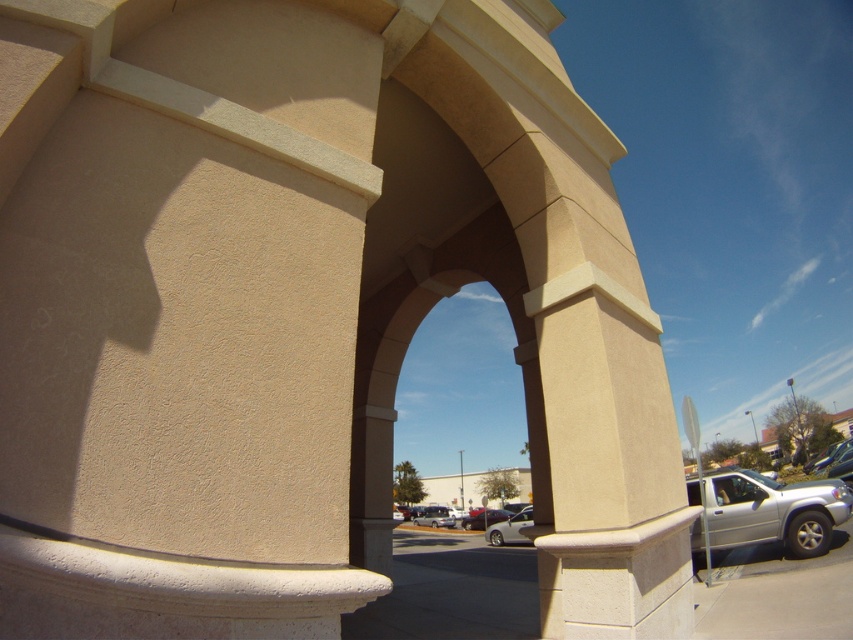
Looking at this image, does silver metallic bus at center have a lesser width compared to metallic silver sedan at center?

In fact, silver metallic bus at center might be wider than metallic silver sedan at center.

Is point (425, 513) less distant than point (491, 513)?

No, (425, 513) is behind (491, 513).

Where is `silver metallic bus at center`? The height and width of the screenshot is (640, 853). silver metallic bus at center is located at coordinates (434, 516).

Who is positioned more to the right, silver metallic truck at lower right or metallic silver car at right?

From the viewer's perspective, metallic silver car at right appears more on the right side.

Based on the photo, does silver metallic truck at lower right have a greater height compared to metallic silver car at right?

Incorrect, silver metallic truck at lower right's height is not larger of metallic silver car at right's.

Which is behind, point (746, 540) or point (846, 442)?

Point (846, 442)

This screenshot has height=640, width=853. What are the coordinates of `silver metallic truck at lower right` in the screenshot? It's located at (767, 512).

Does silver metallic truck at lower right have a lesser width compared to silver metallic bus at center?

No.

Is point (718, 522) less distant than point (451, 524)?

Yes.

Who is more forward, (x=834, y=481) or (x=428, y=506)?

Point (x=834, y=481) is in front.

What are the coordinates of `silver metallic truck at lower right` in the screenshot? It's located at (767, 512).